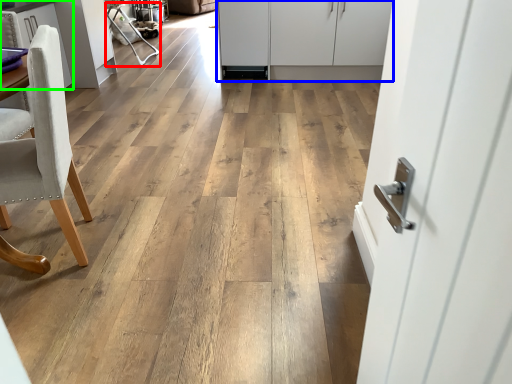
Question: Which object is the closest to the armchair (highlighted by a red box)? Choose among these: cabinetry (highlighted by a blue box) or cabinetry (highlighted by a green box).

Choices:
 (A) cabinetry
 (B) cabinetry

Answer: (B)